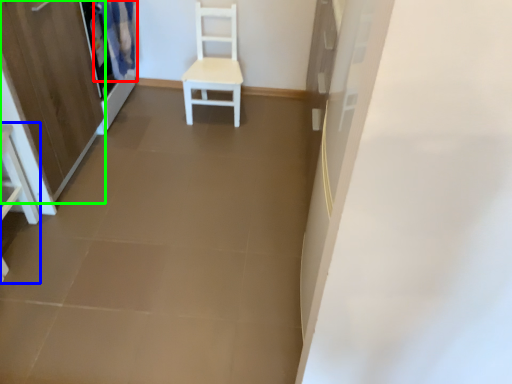
Question: Considering the real-world distances, which object is closest to curtain (highlighted by a red box)? vanity (highlighted by a blue box) or screen door (highlighted by a green box).

Choices:
 (A) vanity
 (B) screen door

Answer: (B)